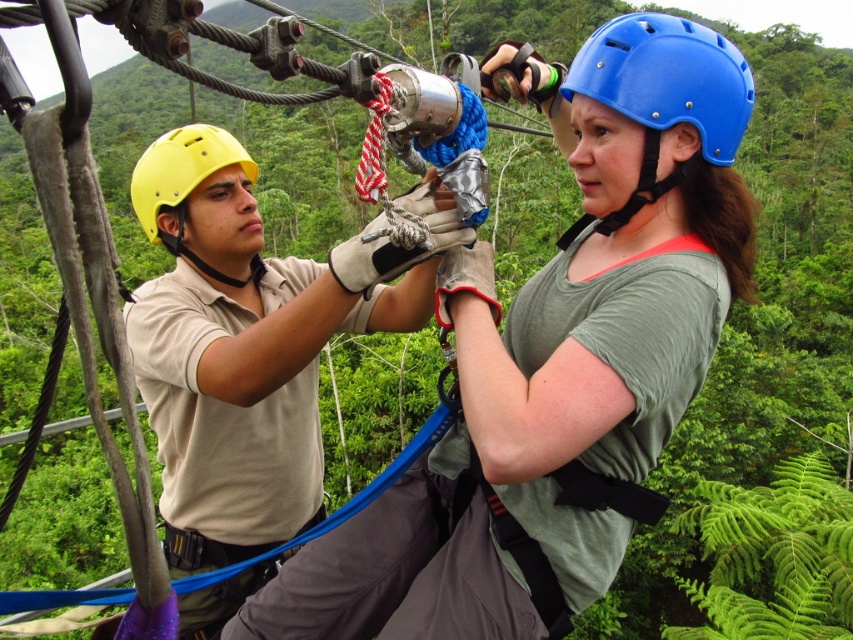
Question: Can you confirm if matte khaki shirt at center is positioned to the right of blue hard plastic helmet at center?

Choices:
 (A) yes
 (B) no

Answer: (B)

Question: Which point is closer to the camera taking this photo?

Choices:
 (A) (202, 141)
 (B) (556, 244)
 (C) (175, 564)

Answer: (B)

Question: Can you confirm if blue hard plastic helmet at center is positioned below yellow matte helmet at upper left?

Choices:
 (A) no
 (B) yes

Answer: (B)

Question: Does matte khaki shirt at center have a greater width compared to yellow matte helmet at upper left?

Choices:
 (A) yes
 (B) no

Answer: (B)

Question: Estimate the real-world distances between objects in this image. Which object is farther from the blue hard plastic helmet at center?

Choices:
 (A) matte khaki shirt at center
 (B) yellow matte helmet at upper left

Answer: (B)

Question: Which is nearer to the matte khaki shirt at center?

Choices:
 (A) blue hard plastic helmet at center
 (B) yellow matte helmet at upper left

Answer: (A)